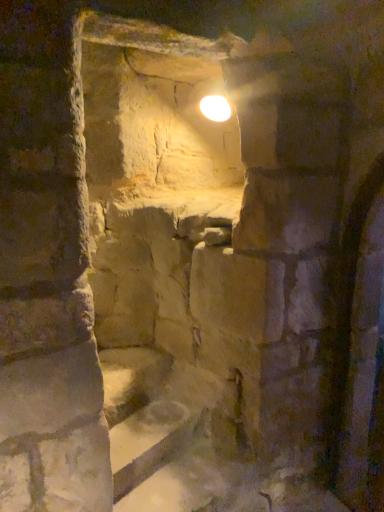
What do you see at coordinates (215, 108) in the screenshot? This screenshot has height=512, width=384. I see `white glossy light bulb at upper center` at bounding box center [215, 108].

The width and height of the screenshot is (384, 512). I want to click on white glossy light bulb at upper center, so click(215, 108).

In order to face white glossy light bulb at upper center, should I rotate leftwards or rightwards?

It's best to rotate right around 3.232 degrees.

What do you see at coordinates (150, 412) in the screenshot? I see `smooth stone stairs at lower center` at bounding box center [150, 412].

Locate an element on the screen. smooth stone stairs at lower center is located at coordinates (150, 412).

Locate an element on the screen. The image size is (384, 512). white glossy light bulb at upper center is located at coordinates (215, 108).

Which is more to the right, smooth stone stairs at lower center or white glossy light bulb at upper center?

From the viewer's perspective, white glossy light bulb at upper center appears more on the right side.

Between smooth stone stairs at lower center and white glossy light bulb at upper center, which one is positioned behind?

white glossy light bulb at upper center is more distant.

Is point (210, 379) more distant than point (207, 113)?

No, (210, 379) is in front of (207, 113).

From the image's perspective, does smooth stone stairs at lower center appear higher than white glossy light bulb at upper center?

No.

From a real-world perspective, who is located lower, smooth stone stairs at lower center or white glossy light bulb at upper center?

smooth stone stairs at lower center.

Is smooth stone stairs at lower center wider than white glossy light bulb at upper center?

Yes, smooth stone stairs at lower center is wider than white glossy light bulb at upper center.

Which of these two, smooth stone stairs at lower center or white glossy light bulb at upper center, stands shorter?

With less height is smooth stone stairs at lower center.

Considering the relative sizes of smooth stone stairs at lower center and white glossy light bulb at upper center in the image provided, is smooth stone stairs at lower center smaller than white glossy light bulb at upper center?

No, smooth stone stairs at lower center is not smaller than white glossy light bulb at upper center.

Does smooth stone stairs at lower center contain white glossy light bulb at upper center?

No, white glossy light bulb at upper center is not a part of smooth stone stairs at lower center.

Is there a large distance between smooth stone stairs at lower center and white glossy light bulb at upper center?

Yes, smooth stone stairs at lower center is far from white glossy light bulb at upper center.

Could you tell me if smooth stone stairs at lower center is facing white glossy light bulb at upper center?

No, smooth stone stairs at lower center is not oriented towards white glossy light bulb at upper center.

Can you tell me how much smooth stone stairs at lower center and white glossy light bulb at upper center differ in facing direction?

There is a 81.8-degree angle between the facing directions of smooth stone stairs at lower center and white glossy light bulb at upper center.

How much distance is there between smooth stone stairs at lower center and white glossy light bulb at upper center?

smooth stone stairs at lower center is 1.76 meters from white glossy light bulb at upper center.

Where is `light behind the smooth stone stairs at lower center`? This screenshot has width=384, height=512. light behind the smooth stone stairs at lower center is located at coordinates (215, 108).

Does white glossy light bulb at upper center appear on the left side of smooth stone stairs at lower center?

No.

Is white glossy light bulb at upper center in front of smooth stone stairs at lower center?

That is False.

Which is closer to the camera, (228, 102) or (139, 395)?

The point (228, 102) is closer.

From the image's perspective, which is below, white glossy light bulb at upper center or smooth stone stairs at lower center?

smooth stone stairs at lower center is shown below in the image.

From a real-world perspective, which is physically above, white glossy light bulb at upper center or smooth stone stairs at lower center?

white glossy light bulb at upper center is physically above.

Is white glossy light bulb at upper center thinner than smooth stone stairs at lower center?

Indeed, white glossy light bulb at upper center has a lesser width compared to smooth stone stairs at lower center.

Considering the relative sizes of white glossy light bulb at upper center and smooth stone stairs at lower center in the image provided, is white glossy light bulb at upper center taller than smooth stone stairs at lower center?

Correct, white glossy light bulb at upper center is much taller as smooth stone stairs at lower center.

Based on the photo, which of these two, white glossy light bulb at upper center or smooth stone stairs at lower center, is smaller?

white glossy light bulb at upper center is smaller.

Is white glossy light bulb at upper center located outside smooth stone stairs at lower center?

Indeed, white glossy light bulb at upper center is completely outside smooth stone stairs at lower center.

Is white glossy light bulb at upper center next to smooth stone stairs at lower center and touching it?

No, white glossy light bulb at upper center is not touching smooth stone stairs at lower center.

Does white glossy light bulb at upper center turn towards smooth stone stairs at lower center?

No, white glossy light bulb at upper center does not turn towards smooth stone stairs at lower center.

Measure the distance from white glossy light bulb at upper center to smooth stone stairs at lower center.

white glossy light bulb at upper center and smooth stone stairs at lower center are 5.77 feet apart from each other.

You are a GUI agent. You are given a task and a screenshot of the screen. Output one action in this format:
    pyautogui.click(x=<x>, y=<y>)
    Task: Click on the stairs on the left of white glossy light bulb at upper center
    The image size is (384, 512).
    Given the screenshot: What is the action you would take?
    pyautogui.click(x=150, y=412)

The width and height of the screenshot is (384, 512). What are the coordinates of `stairs that appears below the white glossy light bulb at upper center (from a real-world perspective)` in the screenshot? It's located at (150, 412).

I want to click on light above the smooth stone stairs at lower center (from the image's perspective), so click(215, 108).